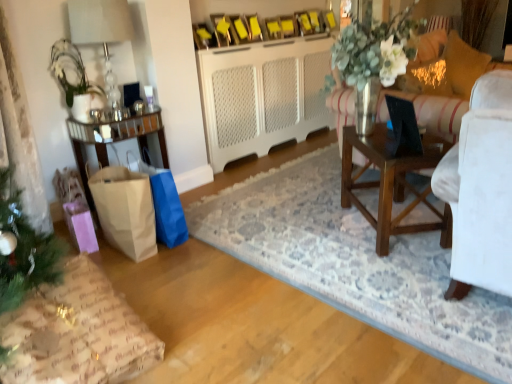
In order to click on free space that is to the left of brown wooden table at center, which ranks as the 1th table in right-to-left order in this screenshot , I will do `click(323, 235)`.